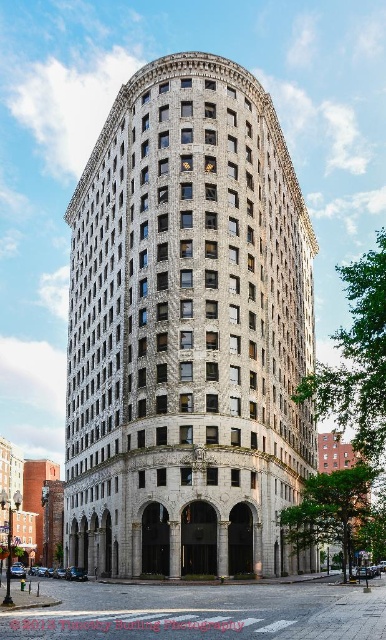
Does white stone building at center come behind brick building at lower right?

Yes, white stone building at center is further from the viewer.

Describe the element at coordinates (187, 332) in the screenshot. The image size is (386, 640). I see `white stone building at center` at that location.

What do you see at coordinates (187, 332) in the screenshot?
I see `white stone building at center` at bounding box center [187, 332].

This screenshot has width=386, height=640. What are the coordinates of `white stone building at center` in the screenshot? It's located at (187, 332).